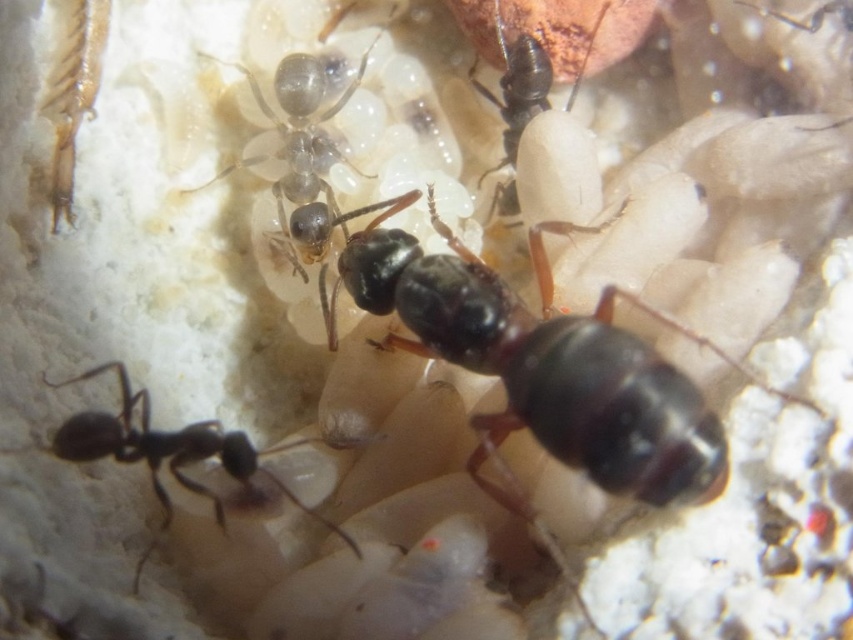
You are holding a 36 inch ruler and want to measure the distance from your eyes to the point at coordinates point (148, 547). Can your ruler reach that point?

The distance between you and the point (148, 547) is 38.19 inches, so the 36 inch ruler is too short to reach that point.

You are an entomologist observing ants in their colony. You notice a translucent gelatinous ant at center and a black glossy ant at upper center. Which ant is located closer to the top of the image?

The black glossy ant at upper center is closer to the top of the image because it is positioned above the translucent gelatinous ant at center.

You are an entomologist observing ants in an ant colony. You notice two ants, the black glossy ant at lower left and the shiny black ant at upper center. Which ant is taller?

The black glossy ant at lower left is taller than the shiny black ant at upper center.